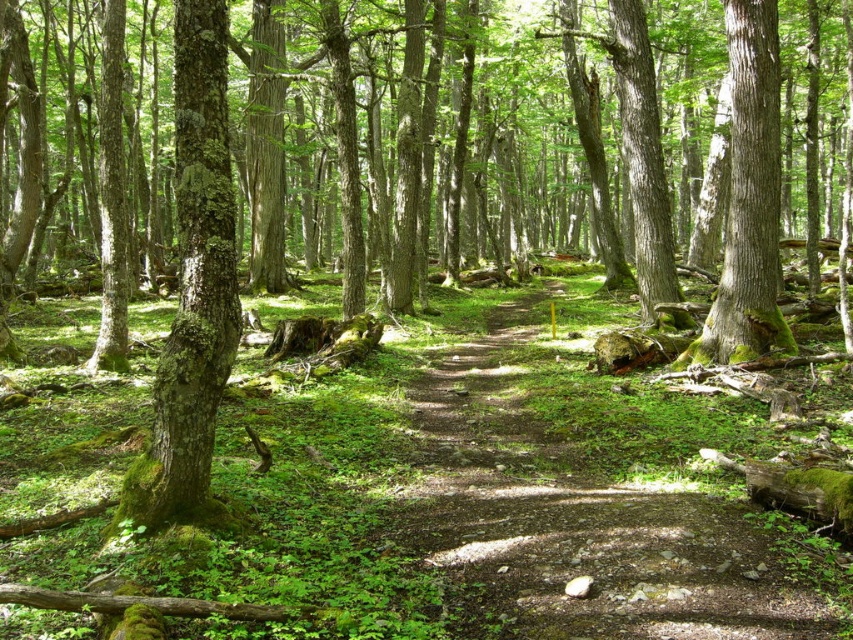
Does dirt path at center have a lesser width compared to green mossy bark tree at left?

No, dirt path at center is not thinner than green mossy bark tree at left.

Measure the distance between point (x=692, y=616) and camera.

A distance of 12.78 feet exists between point (x=692, y=616) and camera.

At what (x,y) coordinates should I click in order to perform the action: click on dirt path at center. Please return your answer as a coordinate pair (x, y). Looking at the image, I should click on (585, 490).

This screenshot has width=853, height=640. Describe the element at coordinates (192, 292) in the screenshot. I see `green mossy bark tree at left` at that location.

Does green mossy bark tree at left have a greater width compared to green mossy tree at right?

Incorrect, green mossy bark tree at left's width does not surpass green mossy tree at right's.

You are a GUI agent. You are given a task and a screenshot of the screen. Output one action in this format:
    pyautogui.click(x=<x>, y=<y>)
    Task: Click on the green mossy bark tree at left
    This screenshot has width=853, height=640.
    Given the screenshot: What is the action you would take?
    pyautogui.click(x=192, y=292)

Between point (524, 490) and point (749, 145), which one is positioned in front?

Point (524, 490) is in front.

Does dirt path at center have a larger size compared to green mossy tree at right?

Yes, dirt path at center is bigger than green mossy tree at right.

Identify the location of dirt path at center. (585, 490).